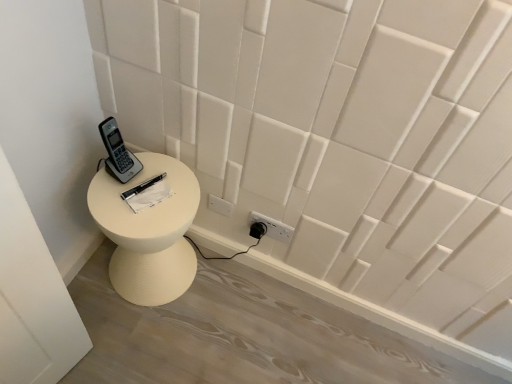
Identify the location of vacant area on the back side of white paper at center. This screenshot has width=512, height=384. coord(159,161).